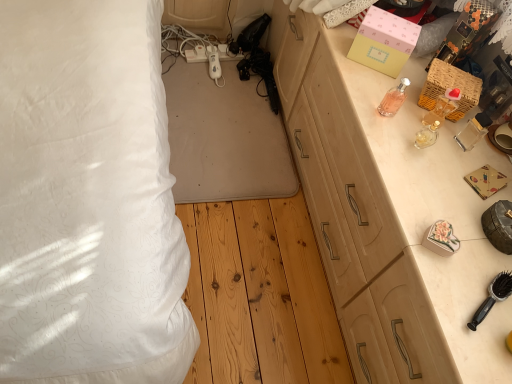
Locate an element on the screen. free spot behind pink glass bottle at upper right, the first perfume in the left-to-right sequence is located at coordinates (372, 76).